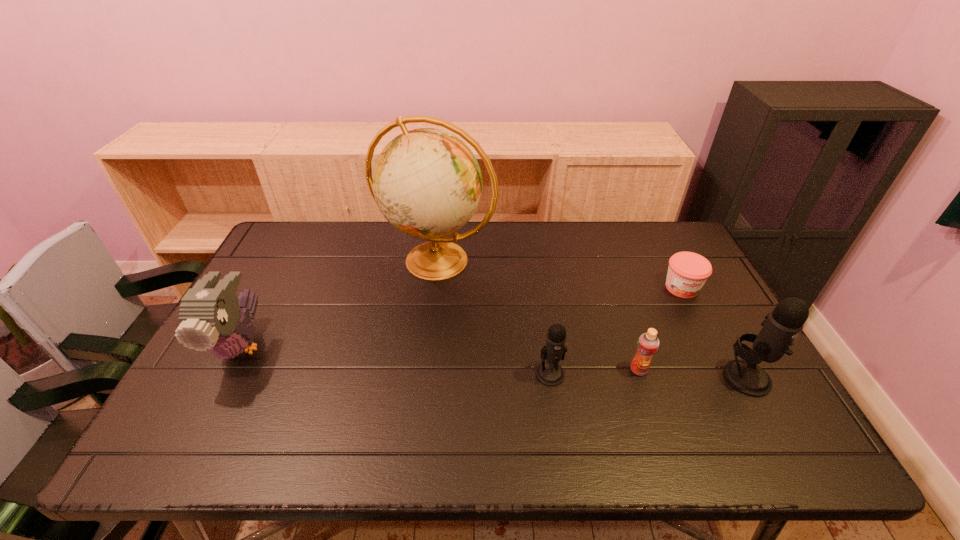
In order to click on the fourth tallest object in this screenshot , I will do `click(549, 373)`.

Find the location of a particular element. the left microphone is located at coordinates (549, 373).

The height and width of the screenshot is (540, 960). Find the location of `the right microphone`. the right microphone is located at coordinates (783, 324).

This screenshot has height=540, width=960. I want to click on the fifth shortest object, so click(x=783, y=324).

The width and height of the screenshot is (960, 540). What are the coordinates of `the tallest object` in the screenshot? It's located at (427, 183).

Where is `globe`? The width and height of the screenshot is (960, 540). globe is located at coordinates (427, 183).

Where is `bird`? The width and height of the screenshot is (960, 540). bird is located at coordinates (211, 315).

This screenshot has height=540, width=960. Find the location of `the third tallest object`. the third tallest object is located at coordinates (211, 315).

The image size is (960, 540). What are the coordinates of `jam` in the screenshot? It's located at (687, 273).

Locate an element on the screen. The height and width of the screenshot is (540, 960). orange juice is located at coordinates (648, 343).